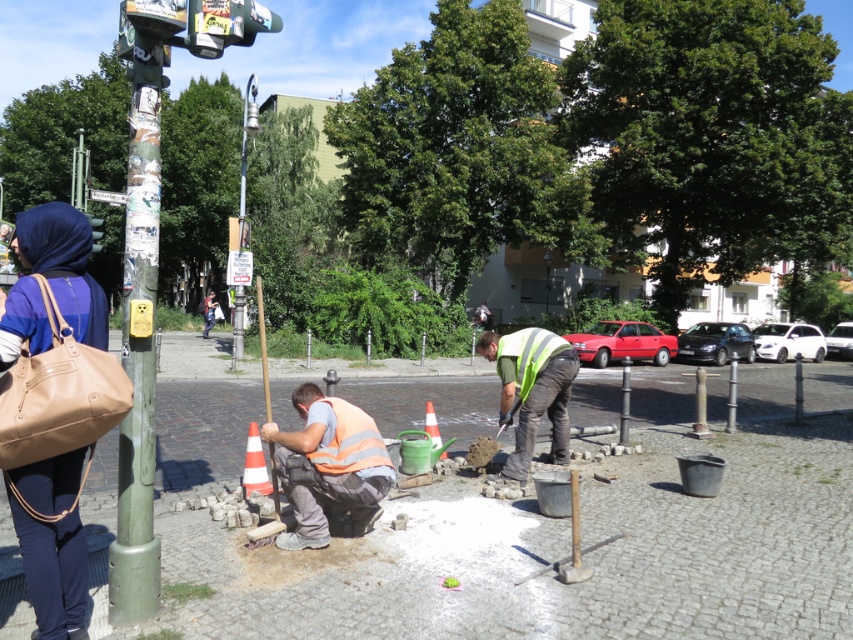
Question: Can you confirm if matte brown leather bag at left is positioned to the left of green painted pole at left?

Choices:
 (A) yes
 (B) no

Answer: (A)

Question: Is white cobblestone pavement at center to the right of orange reflective safety vest at lower center from the viewer's perspective?

Choices:
 (A) yes
 (B) no

Answer: (A)

Question: Among these points, which one is farthest from the camera?

Choices:
 (A) (13, 328)
 (B) (234, 314)
 (C) (151, 214)
 (D) (544, 298)

Answer: (D)

Question: Is white cobblestone pavement at center wider than matte brown leather bag at left?

Choices:
 (A) yes
 (B) no

Answer: (A)

Question: Which of the following is the closest to the observer?

Choices:
 (A) metallic silver streetlight at upper left
 (B) green painted pole at left
 (C) wooden pole at center
 (D) orange reflective safety vest at lower center

Answer: (B)

Question: Which of the following is the farthest from the observer?

Choices:
 (A) (546, 276)
 (B) (120, 580)

Answer: (A)